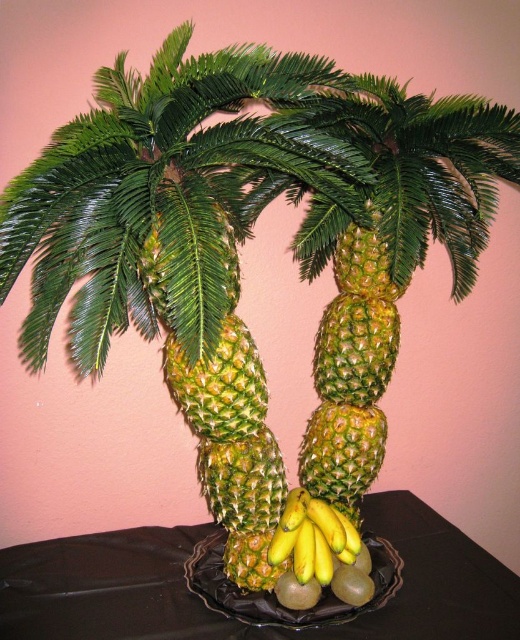
Question: Is black plastic tray at center below yellow smooth bananas at center?

Choices:
 (A) yes
 (B) no

Answer: (A)

Question: Can you confirm if black plastic tray at center is positioned below yellow smooth bananas at center?

Choices:
 (A) yes
 (B) no

Answer: (A)

Question: Is black plastic tray at center positioned in front of yellow smooth bananas at center?

Choices:
 (A) no
 (B) yes

Answer: (B)

Question: Among these objects, which one is nearest to the camera?

Choices:
 (A) yellow smooth bananas at center
 (B) black plastic tray at center

Answer: (B)

Question: Among these points, which one is farthest from the camera?

Choices:
 (A) (319, 550)
 (B) (497, 579)

Answer: (B)